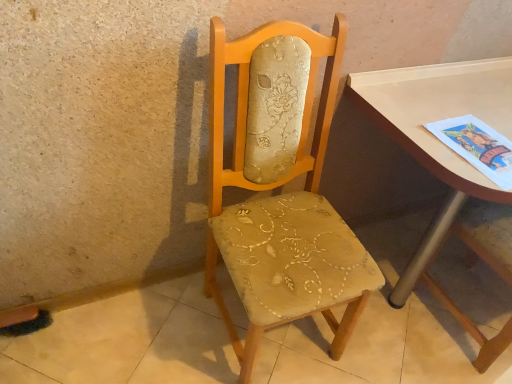
What are the coordinates of `vacant area situated below matte beige fabric chair at center (from a real-world perspective)` in the screenshot? It's located at tap(282, 338).